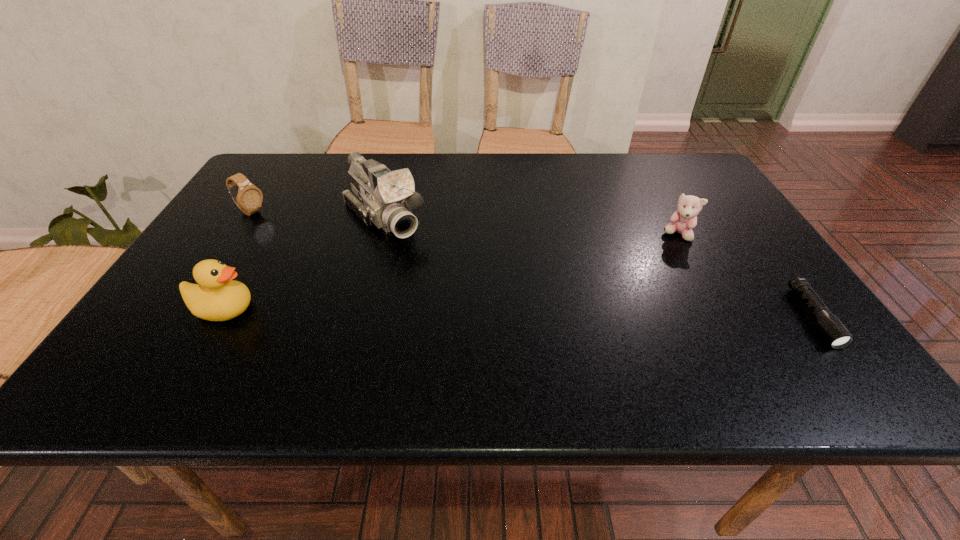
This screenshot has height=540, width=960. I want to click on empty space that is in between the second tallest object and the watch, so click(x=237, y=261).

This screenshot has height=540, width=960. I want to click on free area in between the second object from right to left and the camcorder, so click(x=531, y=226).

At what (x,y) coordinates should I click in order to perform the action: click on free space between the shortest object and the camcorder. Please return your answer as a coordinate pair (x, y). This screenshot has width=960, height=540. Looking at the image, I should click on (598, 268).

Where is `vacant area between the teddy bear and the third object from right to left`? The image size is (960, 540). vacant area between the teddy bear and the third object from right to left is located at coordinates (531, 226).

Locate an element on the screen. This screenshot has width=960, height=540. vacant space in between the second object from right to left and the shortest object is located at coordinates (746, 276).

This screenshot has height=540, width=960. Identify the location of vacant space in between the watch and the shortest object. (532, 265).

Find the location of a particular element. free area in between the shortest object and the tallest object is located at coordinates (598, 268).

Locate an element on the screen. The image size is (960, 540). free spot between the watch and the fourth object from left to right is located at coordinates (465, 224).

I want to click on empty space that is in between the fourth object from left to right and the flashlight, so click(746, 276).

I want to click on free space between the watch and the flashlight, so click(532, 265).